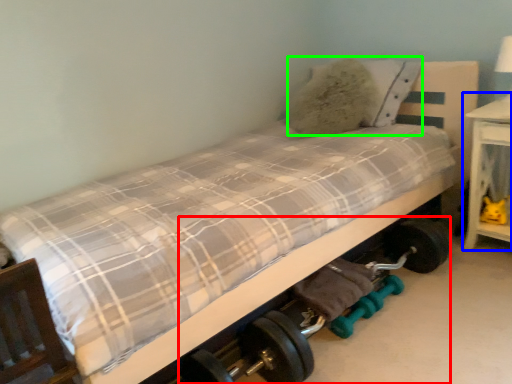
Question: Which is farther away from baby carriage (highlighted by a red box)? table (highlighted by a blue box) or pillow (highlighted by a green box)?

Choices:
 (A) table
 (B) pillow

Answer: (B)